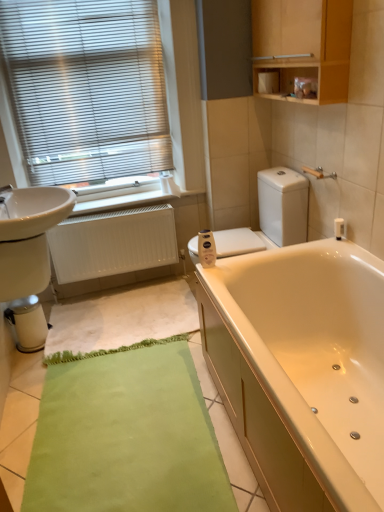
At what (x,y) coordinates should I click in order to perform the action: click on free point in front of white textured bath mat at lower center. Please return your answer as a coordinate pair (x, y). Looking at the image, I should click on [107, 413].